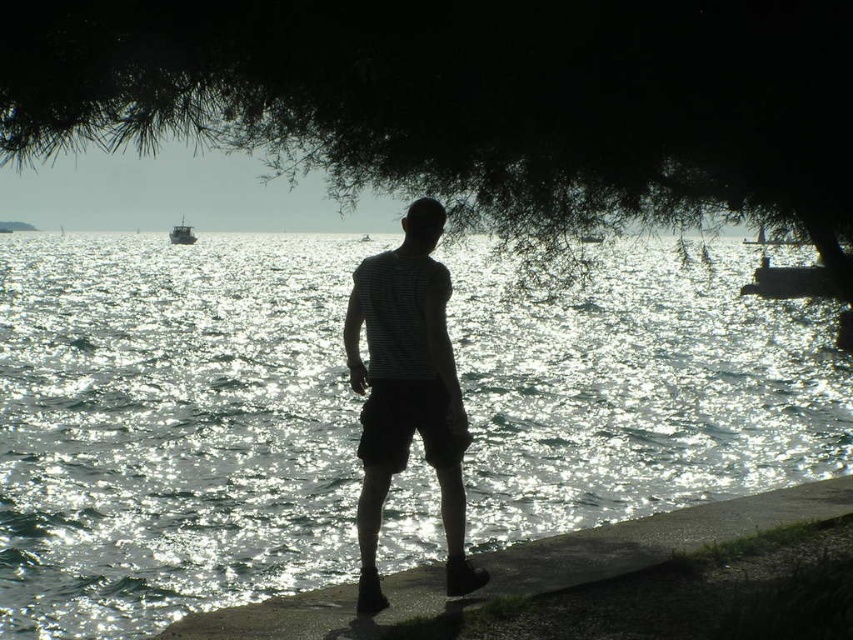
You are standing on the walkway and want to take a photo of both the sparkling silver water at center and the metallic silver boat at center. Which object should you focus on first to ensure both are in focus?

You should focus on the metallic silver boat at center first because it is farther away from the viewer than the sparkling silver water at center, so adjusting focus from far to near can help capture both in focus.

You are a photographer trying to capture the perfect shot of the black cotton shorts at center in the coastal scene. To ensure the shorts are in the foreground, where should you position your camera relative to the person? Please provide coordinates based on the image grid system where the bottom left corner is 0,0 and the top right is 1,1.

The black cotton shorts at center is located at point (410,422). To place them in the foreground, position your camera slightly below and to the right of this coordinate to ensure the shorts are closer to the camera.